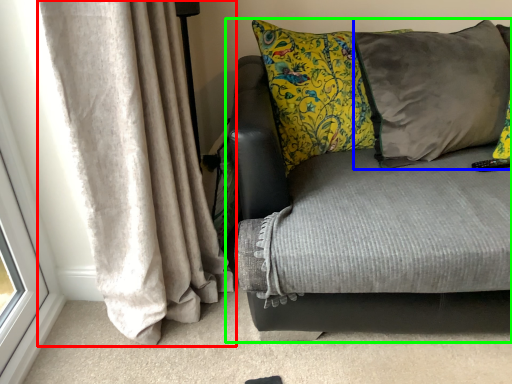
Question: Considering the real-world distances, which object is closest to curtain (highlighted by a red box)? pillow (highlighted by a blue box) or studio couch (highlighted by a green box).

Choices:
 (A) pillow
 (B) studio couch

Answer: (B)